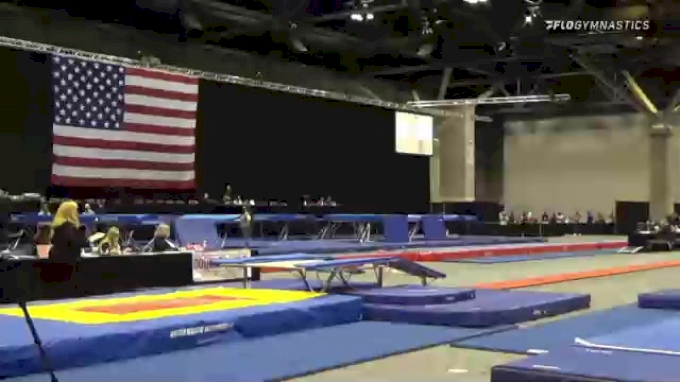
The image size is (680, 382). Identify the location of light green flooring. (430, 366), (612, 287), (481, 270).